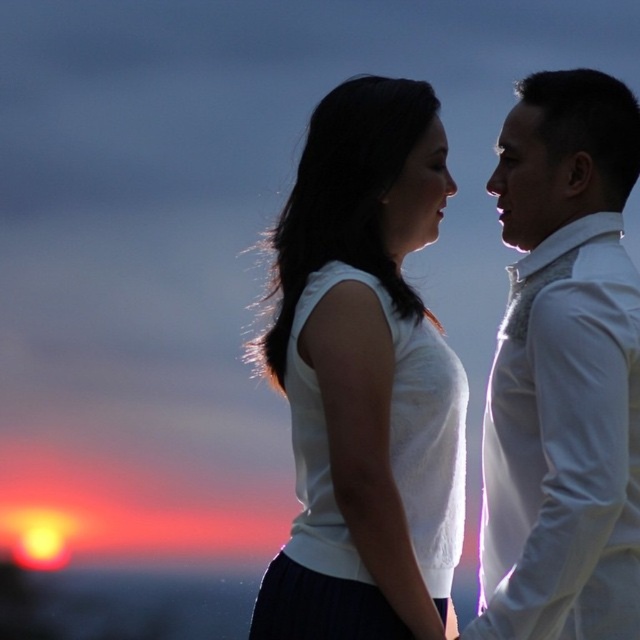
Is white matte tank top at center to the left of white textured shirt at right from the viewer's perspective?

Correct, you'll find white matte tank top at center to the left of white textured shirt at right.

Between point (381, 616) and point (596, 536), which one is positioned in front?

Point (596, 536)

Between point (328, 250) and point (564, 451), which one is positioned in front?

Point (564, 451)

Identify the location of white matte tank top at center. (360, 368).